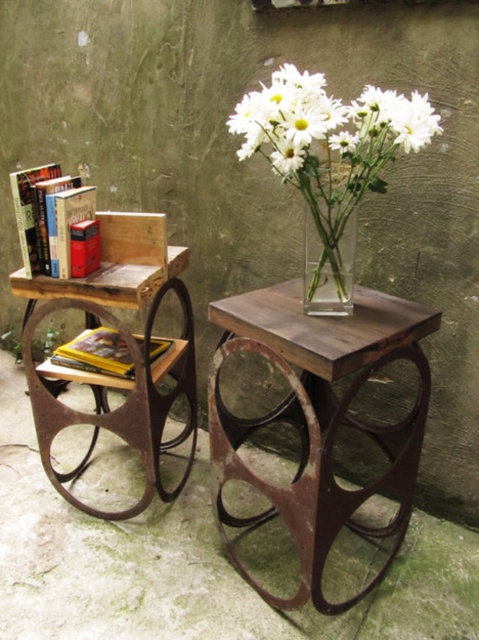
You need to place a rectangular decorative item that is 15 inches wide on the wooden table at center. Considering the white matte vase at upper center is already there, will there be enough space on the table to accommodate the item without moving the vase?

The wooden table at center has a larger width than the white matte vase at upper center. Since the table is wider, there should be enough space to place the 15 inch wide decorative item alongside the vase without moving it.

You are organizing a bookshelf and need to place the wooden table at left and the hardcover book at left. Which item should you place first if you want to ensure there is enough space for both?

You should place the wooden table at left first because it is larger than the hardcover book at left, so placing it first ensures there is enough space left for the smaller item.

You are arranging flowers in the white matte vase at upper center and need to place it next to the hardcover book at left. Is the vase currently positioned to the right or left of the book?

The white matte vase at upper center is to the right of the hardcover book at left.